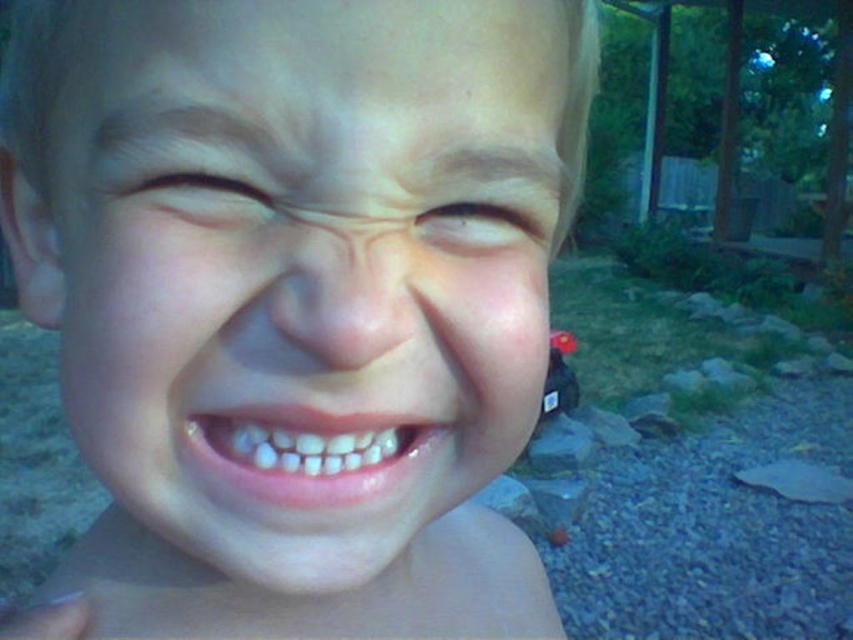
Based on the scene description, which object is bigger between the smooth skin face at center and the brown matte eye at upper center?

The smooth skin face at center is larger than the brown matte eye at upper center.

You are a photographer trying to focus on the child in the image. Since the smooth skin face at center and the brown matte eye at upper center are both in view, which one is closer to the camera?

The smooth skin face at center is closer to the camera than the brown matte eye at upper center because it is in front of it.

The image shows a young child with a playful expression. There is a point located at coordinates (303, 595). Based on the scene description, where is this point most likely located on the child?

The point at (303, 595) is on the skin at the center of the child.